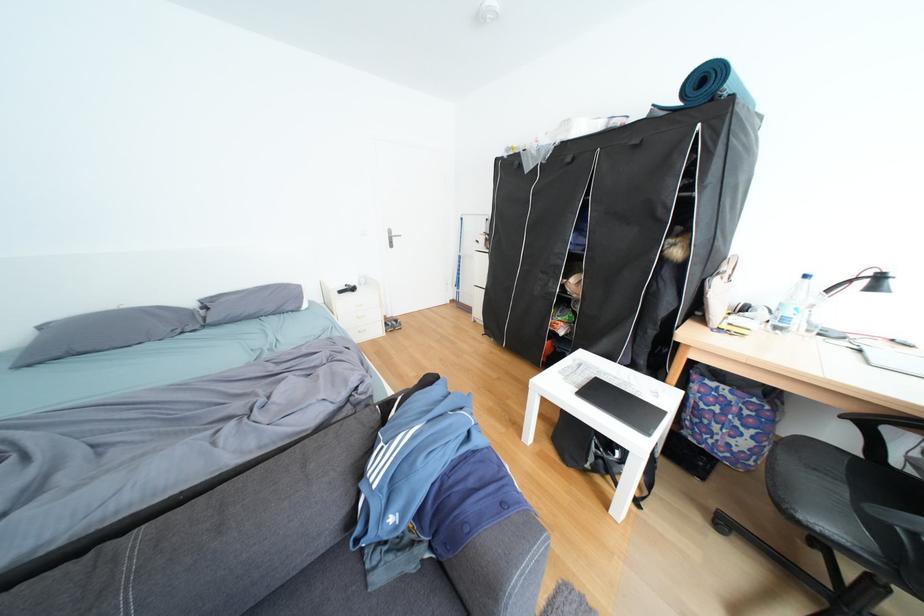
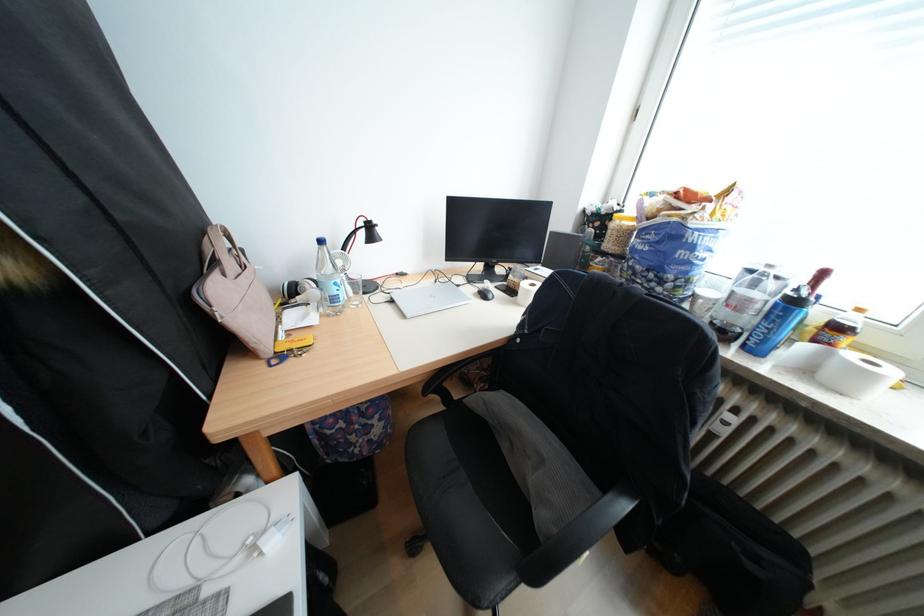
Find the pixel in the second image that matches (874,456) in the first image.

(456, 408)